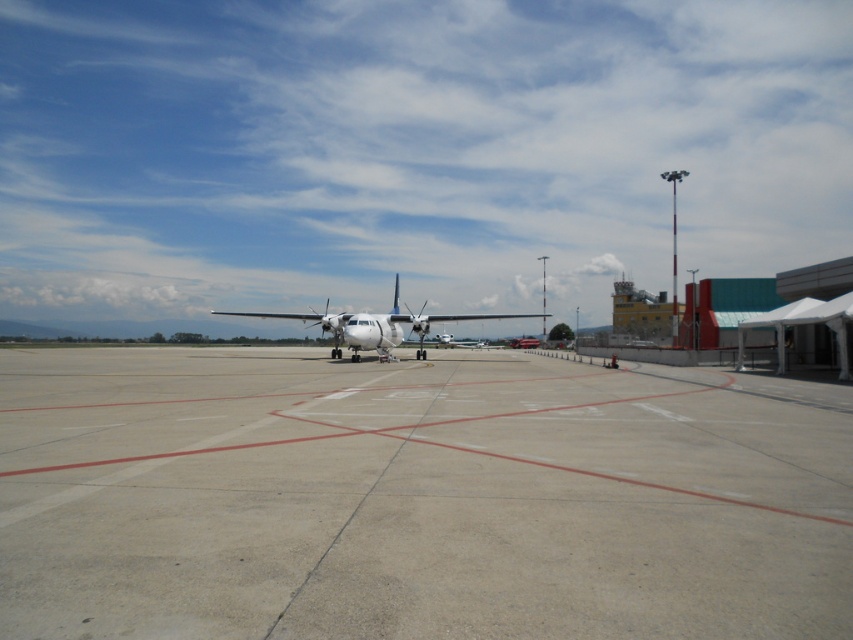
Is gray concrete tarmac at center positioned behind white matte airplane at center?

No, gray concrete tarmac at center is in front of white matte airplane at center.

Between gray concrete tarmac at center and white matte airplane at center, which one has less height?

gray concrete tarmac at center is shorter.

What do you see at coordinates (416, 499) in the screenshot? The image size is (853, 640). I see `gray concrete tarmac at center` at bounding box center [416, 499].

Find the location of a particular element. Image resolution: width=853 pixels, height=640 pixels. gray concrete tarmac at center is located at coordinates (416, 499).